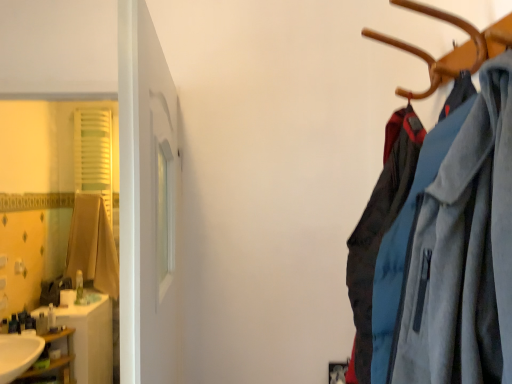
Question: Is matte brown cardigan at left inside or outside of white glossy sink at lower left?

Choices:
 (A) outside
 (B) inside

Answer: (A)

Question: From the image's perspective, relative to white glossy sink at lower left, is matte brown cardigan at left above or below?

Choices:
 (A) below
 (B) above

Answer: (B)

Question: Based on their relative distances, which object is farther from the translucent plastic bottle at left, which ranks as the 5th toiletry in front-to-back order?

Choices:
 (A) white glossy sink at lower left
 (B) translucent plastic soap at left, which is the second toiletry in front-to-back order
 (C) translucent plastic soap at left, which is the 4th toiletry from right to left
 (D) translucent plastic soap at left, which is counted as the 5th toiletry, starting from the right
 (E) matte brown cardigan at left

Answer: (A)

Question: Considering the real-world distances, which object is farthest from the translucent plastic bottle at left, which is the 1th toiletry in right-to-left order?

Choices:
 (A) translucent plastic soap at left, which is counted as the 5th toiletry, starting from the right
 (B) translucent plastic soap at left, which is the second toiletry in front-to-back order
 (C) white glossy sink at lower left
 (D) wooden shelf at lower left
 (E) translucent plastic soap at left, acting as the 3th toiletry starting from the back

Answer: (C)